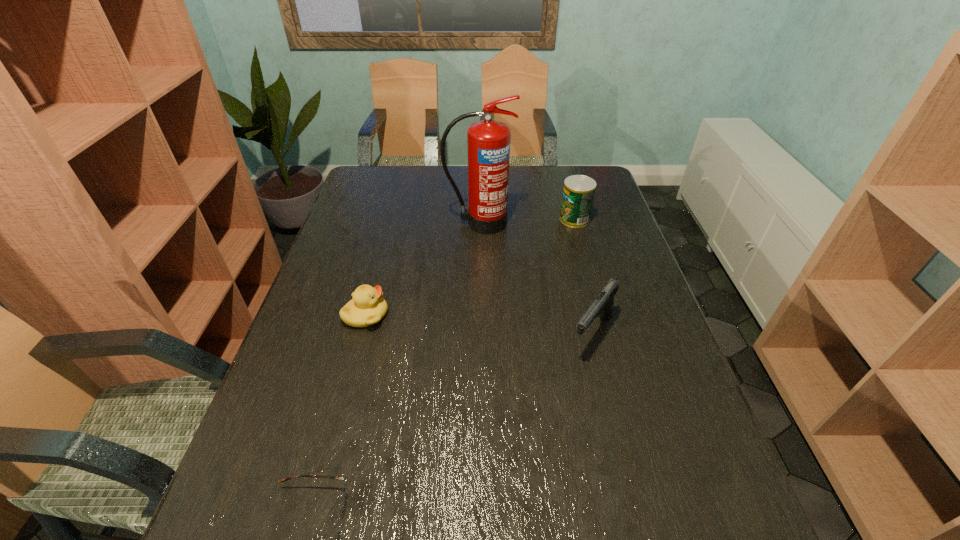
Locate an element on the screen. Image resolution: width=960 pixels, height=540 pixels. vacant space that is in between the gun and the fire extinguisher is located at coordinates (536, 279).

Find the location of a particular element. This screenshot has height=540, width=960. vacant area that lies between the duckling and the can is located at coordinates (470, 267).

At what (x,y) coordinates should I click in order to perform the action: click on empty space that is in between the fire extinguisher and the gun. Please return your answer as a coordinate pair (x, y). The height and width of the screenshot is (540, 960). Looking at the image, I should click on (536, 279).

I want to click on object that is the closest to the shortest object, so click(367, 307).

This screenshot has height=540, width=960. Find the location of `object that ranks as the closest to the tallest object`. object that ranks as the closest to the tallest object is located at coordinates (578, 194).

The height and width of the screenshot is (540, 960). Find the location of `blank area in the image that satisfies the following two spatial constraints: 1. on the surface of the third object from right to left; 2. on the beak of the second shortest object`. blank area in the image that satisfies the following two spatial constraints: 1. on the surface of the third object from right to left; 2. on the beak of the second shortest object is located at coordinates (478, 315).

Identify the location of free space that satisfies the following two spatial constraints: 1. on the surface of the fire extinguisher; 2. on the beak of the fourth tallest object. The width and height of the screenshot is (960, 540). pyautogui.click(x=478, y=315).